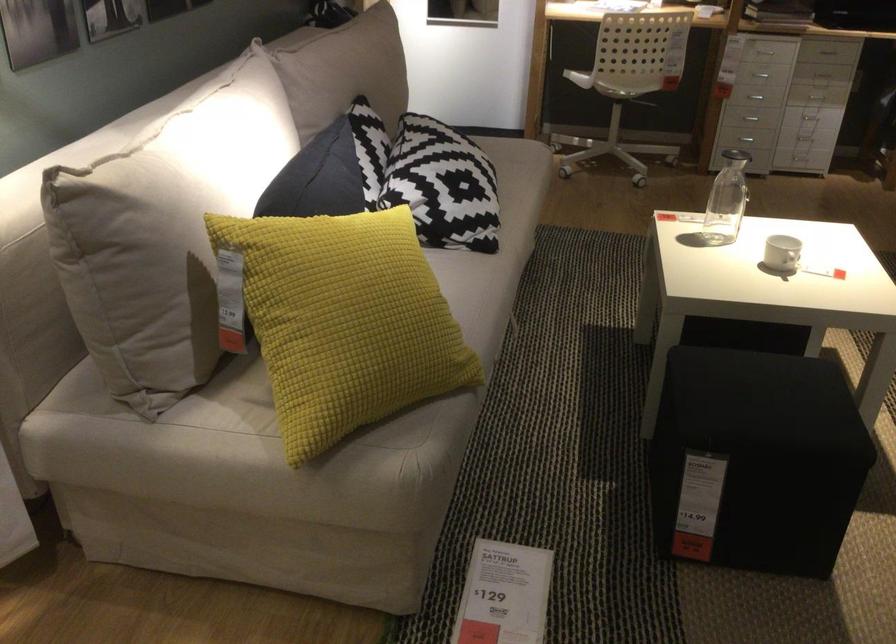
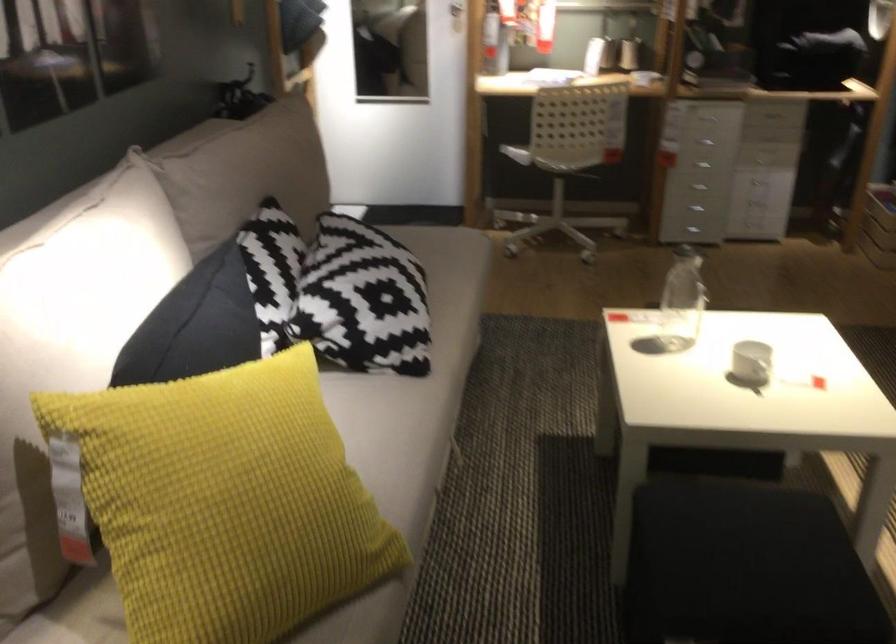
Question: How did the camera likely rotate?

Choices:
 (A) Left
 (B) Right
 (C) Up
 (D) Down

Answer: (C)